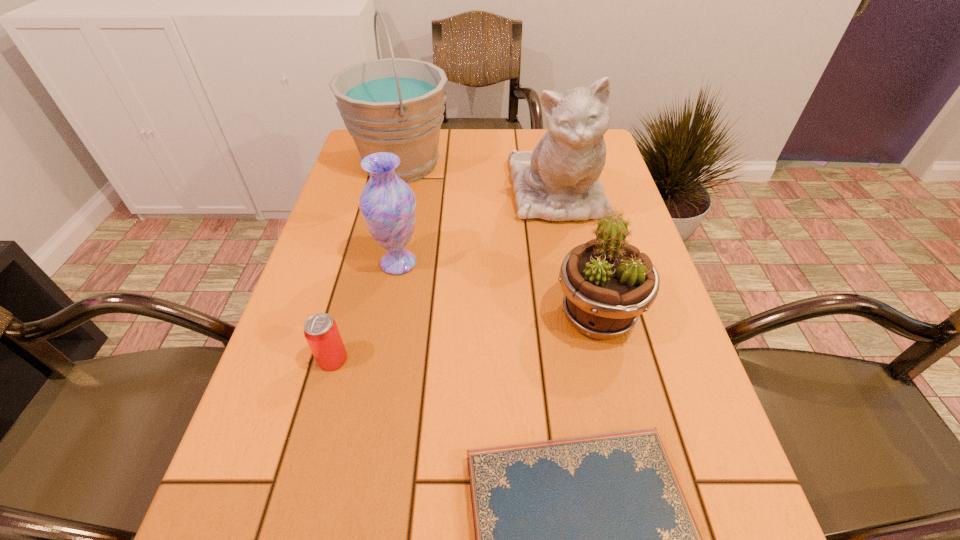
I want to click on bucket that is at the far edge, so click(396, 105).

In order to click on cat that is at the far edge in this screenshot , I will do `click(559, 180)`.

Where is `bucket present at the left edge`? This screenshot has width=960, height=540. bucket present at the left edge is located at coordinates (396, 105).

The width and height of the screenshot is (960, 540). Find the location of `vase that is at the left edge`. vase that is at the left edge is located at coordinates (387, 203).

Locate an element on the screen. The height and width of the screenshot is (540, 960). can at the left edge is located at coordinates point(321,332).

At what (x,y) coordinates should I click in order to perform the action: click on cat that is at the right edge. Please return your answer as a coordinate pair (x, y). The image size is (960, 540). Looking at the image, I should click on (559, 180).

This screenshot has width=960, height=540. I want to click on flowerpot positioned at the right edge, so click(608, 283).

Where is `object located at the far left corner`? object located at the far left corner is located at coordinates (396, 105).

This screenshot has width=960, height=540. What are the coordinates of `object situated at the far right corner` in the screenshot? It's located at (559, 180).

In order to click on vacant space at the far edge of the desktop in this screenshot , I will do `click(529, 139)`.